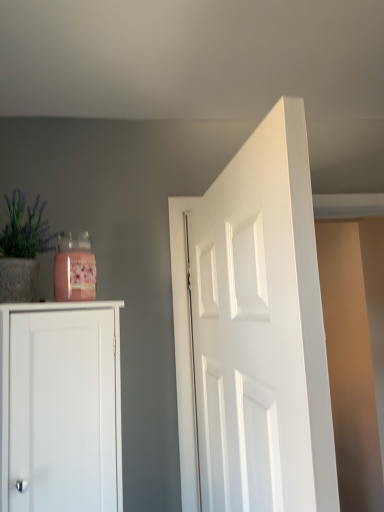
Question: Is white smooth door at center not close to matte gray pot at left?

Choices:
 (A) yes
 (B) no

Answer: (B)

Question: Is white smooth door at center turned away from matte gray pot at left?

Choices:
 (A) no
 (B) yes

Answer: (B)

Question: Considering the relative positions of white smooth door at center and matte gray pot at left in the image provided, is white smooth door at center to the left of matte gray pot at left from the viewer's perspective?

Choices:
 (A) no
 (B) yes

Answer: (A)

Question: Could you tell me if white smooth door at center is facing matte gray pot at left?

Choices:
 (A) yes
 (B) no

Answer: (B)

Question: Can you confirm if white smooth door at center is taller than matte gray pot at left?

Choices:
 (A) yes
 (B) no

Answer: (A)

Question: Can you confirm if white smooth door at center is wider than matte gray pot at left?

Choices:
 (A) yes
 (B) no

Answer: (B)

Question: Does matte gray pot at left have a smaller size compared to white smooth door at center?

Choices:
 (A) yes
 (B) no

Answer: (A)

Question: Does matte gray pot at left lie in front of white smooth door at center?

Choices:
 (A) no
 (B) yes

Answer: (A)

Question: Is matte gray pot at left oriented towards white smooth door at center?

Choices:
 (A) no
 (B) yes

Answer: (B)

Question: Does matte gray pot at left appear on the right side of white smooth door at center?

Choices:
 (A) no
 (B) yes

Answer: (A)

Question: From the image's perspective, is matte gray pot at left under white smooth door at center?

Choices:
 (A) no
 (B) yes

Answer: (A)

Question: Does matte gray pot at left have a larger size compared to white smooth door at center?

Choices:
 (A) yes
 (B) no

Answer: (B)

Question: In the image, is matte gray pot at left on the left side or the right side of white smooth door at center?

Choices:
 (A) right
 (B) left

Answer: (B)